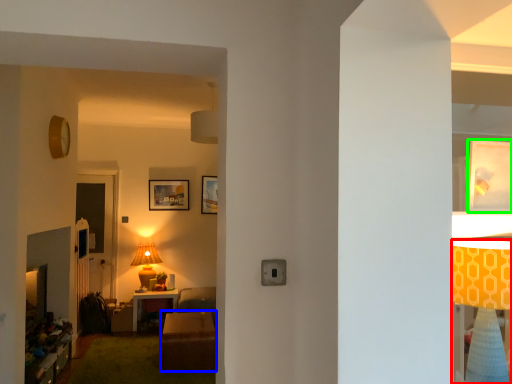
Question: Based on their relative distances, which object is farther from lamp (highlighted by a red box)? Choose from table (highlighted by a blue box) and picture frame (highlighted by a green box).

Choices:
 (A) table
 (B) picture frame

Answer: (A)